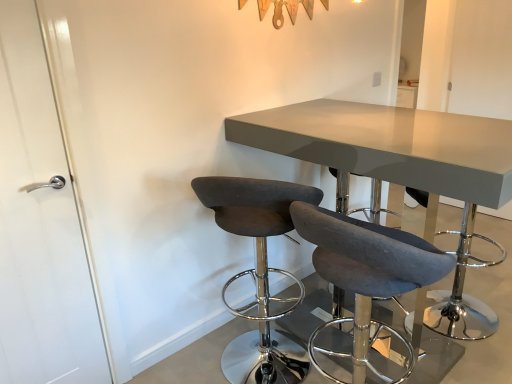
Question: Does dark gray fabric stool at center, the second chair viewed from the right, come behind white glossy door at left?

Choices:
 (A) no
 (B) yes

Answer: (B)

Question: From the image's perspective, does dark gray fabric stool at center, the first chair positioned from the left, appear higher than white glossy door at left?

Choices:
 (A) no
 (B) yes

Answer: (A)

Question: Can white glossy door at left be found inside dark gray fabric stool at center, the first chair positioned from the left?

Choices:
 (A) yes
 (B) no

Answer: (B)

Question: From a real-world perspective, is dark gray fabric stool at center, the first chair positioned from the left, physically below white glossy door at left?

Choices:
 (A) yes
 (B) no

Answer: (A)

Question: Considering the relative sizes of dark gray fabric stool at center, the first chair positioned from the left, and white glossy door at left in the image provided, is dark gray fabric stool at center, the first chair positioned from the left, smaller than white glossy door at left?

Choices:
 (A) yes
 (B) no

Answer: (B)

Question: From the image's perspective, is dark gray fabric stool at center, the first chair positioned from the left, located beneath white glossy door at left?

Choices:
 (A) no
 (B) yes

Answer: (B)

Question: Does dark gray fabric stool at center, the first chair viewed from the right, appear on the left side of dark gray fabric stool at center, the first chair positioned from the left?

Choices:
 (A) no
 (B) yes

Answer: (A)

Question: Is dark gray fabric stool at center, the first chair viewed from the right, turned away from dark gray fabric stool at center, the second chair viewed from the right?

Choices:
 (A) yes
 (B) no

Answer: (B)

Question: Could you tell me if dark gray fabric stool at center, the first chair viewed from the right, is turned towards dark gray fabric stool at center, the second chair viewed from the right?

Choices:
 (A) yes
 (B) no

Answer: (B)

Question: Is dark gray fabric stool at center, the 2th chair from the left, to the right of dark gray fabric stool at center, the first chair positioned from the left, from the viewer's perspective?

Choices:
 (A) no
 (B) yes

Answer: (B)

Question: Can we say dark gray fabric stool at center, the first chair viewed from the right, lies outside dark gray fabric stool at center, the first chair positioned from the left?

Choices:
 (A) yes
 (B) no

Answer: (A)

Question: From a real-world perspective, is dark gray fabric stool at center, the first chair viewed from the right, on dark gray fabric stool at center, the first chair positioned from the left?

Choices:
 (A) yes
 (B) no

Answer: (B)

Question: Is matte gray table at center bigger than white glossy door at left?

Choices:
 (A) yes
 (B) no

Answer: (A)